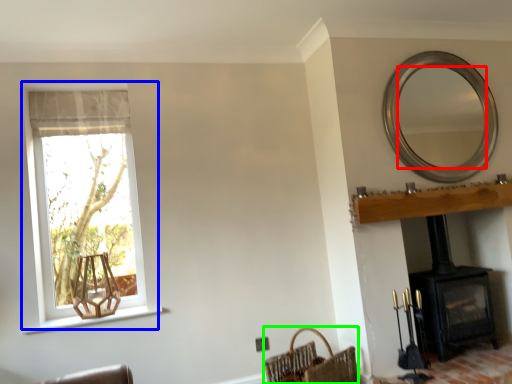
Question: Estimate the real-world distances between objects in this image. Which object is farther from mirror (highlighted by a red box), window (highlighted by a blue box) or basket (highlighted by a green box)?

Choices:
 (A) window
 (B) basket

Answer: (A)